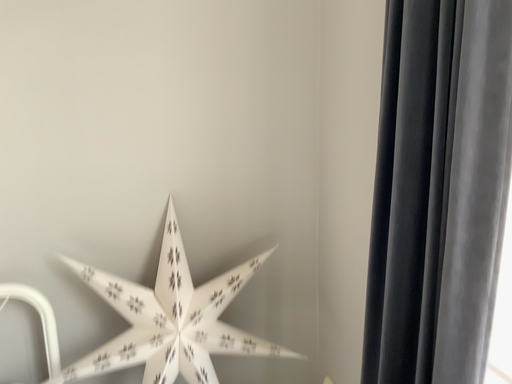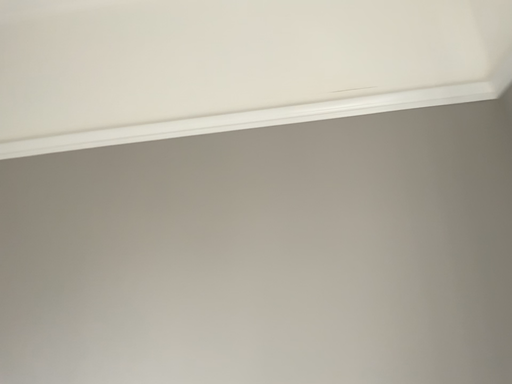
Question: How did the camera likely rotate when shooting the video?

Choices:
 (A) rotated right
 (B) rotated left

Answer: (B)